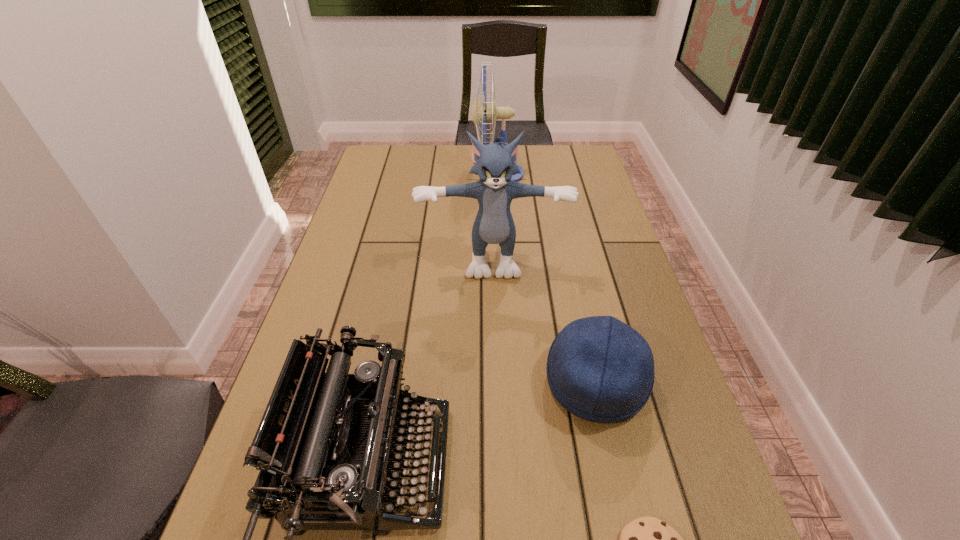
The image size is (960, 540). I want to click on fan, so click(492, 112).

You are a GUI agent. You are given a task and a screenshot of the screen. Output one action in this format:
    pyautogui.click(x=<x>, y=<y>)
    Task: Click on the second farthest object
    Image resolution: width=960 pixels, height=540 pixels.
    Given the screenshot: What is the action you would take?
    pyautogui.click(x=495, y=164)

Locate an element on the screen. This screenshot has height=540, width=960. the fourth tallest object is located at coordinates (600, 369).

Identify the location of free region located 0.210m at the front of the fan where the blades are visible. The height and width of the screenshot is (540, 960). (415, 174).

Identify the location of vacant space located at the front of the fan where the blades are visible. (372, 174).

Image resolution: width=960 pixels, height=540 pixels. What are the coordinates of `free point located at the front of the fan where the blades are visible` in the screenshot? It's located at (400, 174).

This screenshot has width=960, height=540. Find the location of `vacant space located 0.080m on the front-facing side of the fourth nearest object`. vacant space located 0.080m on the front-facing side of the fourth nearest object is located at coordinates (494, 303).

Locate an element on the screen. This screenshot has height=540, width=960. free space located on the back of the skullcap is located at coordinates (563, 236).

At what (x,y) coordinates should I click in order to perform the action: click on object that is at the far edge. Please return your answer as a coordinate pair (x, y). The image size is (960, 540). Looking at the image, I should click on (492, 112).

In order to click on object that is at the right edge in this screenshot , I will do `click(600, 369)`.